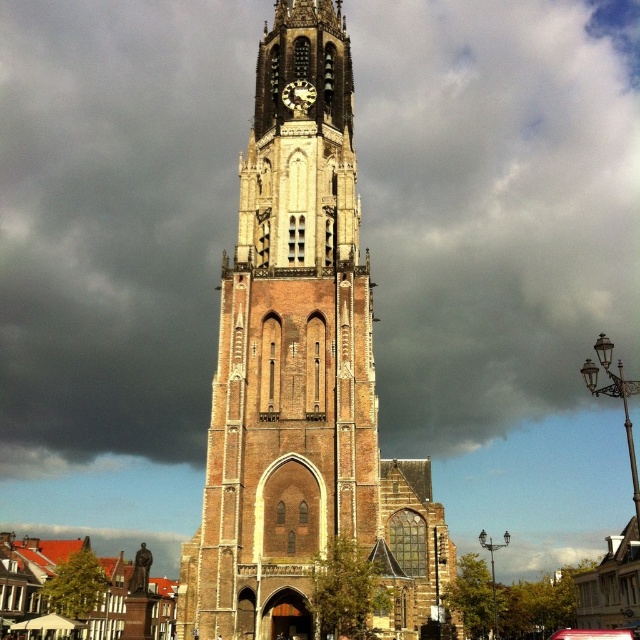
Question: Which point appears farthest from the camera in this image?

Choices:
 (A) (310, 275)
 (B) (304, 90)

Answer: (B)

Question: Where is brown brick tower at center located in relation to wooden clock face at center in the image?

Choices:
 (A) right
 (B) left

Answer: (A)

Question: Considering the relative positions of brown brick tower at center and wooden clock face at center in the image provided, where is brown brick tower at center located with respect to wooden clock face at center?

Choices:
 (A) left
 (B) right

Answer: (B)

Question: Can you confirm if brown brick tower at center is positioned to the left of wooden clock face at center?

Choices:
 (A) yes
 (B) no

Answer: (B)

Question: Among these points, which one is farthest from the camera?

Choices:
 (A) (204, 605)
 (B) (301, 96)

Answer: (B)